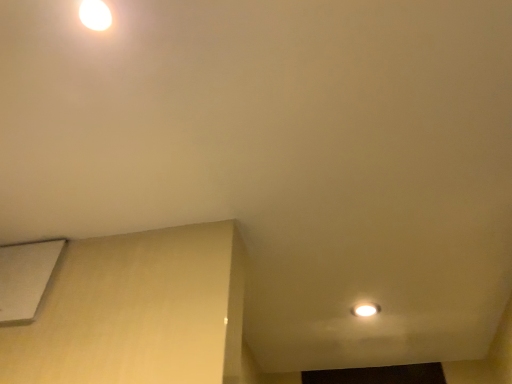
Question: Is the depth of white glossy light fixture at upper left greater than that of white matte lift at lower left?

Choices:
 (A) yes
 (B) no

Answer: (B)

Question: From a real-world perspective, is white glossy light fixture at upper left located beneath white matte lift at lower left?

Choices:
 (A) no
 (B) yes

Answer: (A)

Question: Is there a large distance between white glossy light fixture at upper left and white matte lift at lower left?

Choices:
 (A) no
 (B) yes

Answer: (A)

Question: Is white glossy light fixture at upper left thinner than white matte lift at lower left?

Choices:
 (A) no
 (B) yes

Answer: (A)

Question: Does white glossy light fixture at upper left contain white matte lift at lower left?

Choices:
 (A) yes
 (B) no

Answer: (B)

Question: Is white glossy light fixture at upper left at the right side of white matte lift at lower left?

Choices:
 (A) yes
 (B) no

Answer: (A)

Question: Would you say white glossy light fixture at upper left is part of white matte lift at lower left's contents?

Choices:
 (A) no
 (B) yes

Answer: (A)

Question: From a real-world perspective, does white matte lift at lower left sit lower than white glossy light fixture at upper left?

Choices:
 (A) yes
 (B) no

Answer: (A)

Question: Does white matte lift at lower left have a greater width compared to white glossy light fixture at upper left?

Choices:
 (A) no
 (B) yes

Answer: (A)

Question: Is white matte lift at lower left behind white glossy light fixture at upper left?

Choices:
 (A) yes
 (B) no

Answer: (A)

Question: From the image's perspective, is white matte lift at lower left under white glossy light fixture at upper left?

Choices:
 (A) yes
 (B) no

Answer: (A)

Question: Can we say white matte lift at lower left lies outside white glossy light fixture at upper left?

Choices:
 (A) yes
 (B) no

Answer: (A)

Question: From the image's perspective, is white glossy light fixture at upper left above or below white matte lift at lower left?

Choices:
 (A) below
 (B) above

Answer: (B)